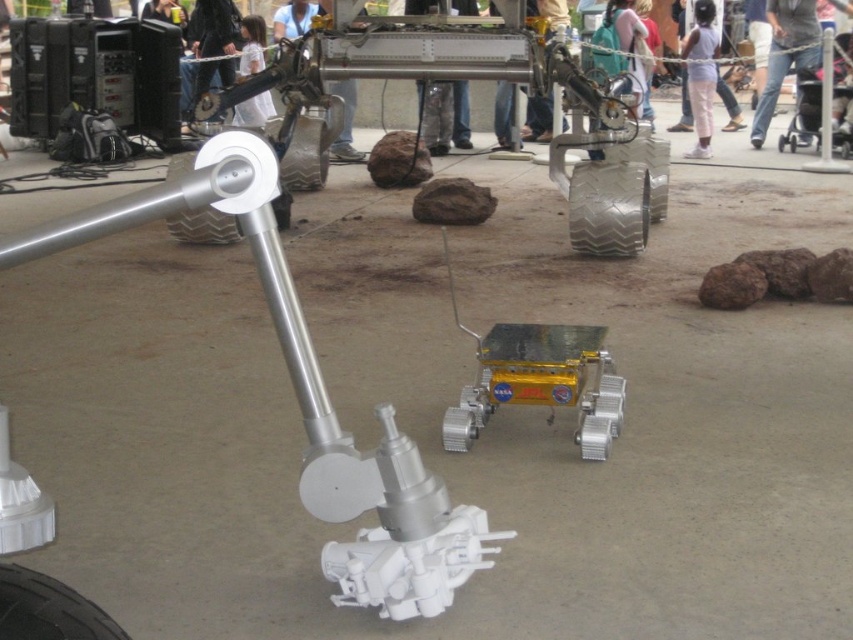
Can you confirm if black rubber tire at lower left is smaller than white fabric shirt at upper center?

Yes.

Who is shorter, black rubber tire at lower left or white fabric shirt at upper center?

black rubber tire at lower left

Locate an element on the screen. Image resolution: width=853 pixels, height=640 pixels. black rubber tire at lower left is located at coordinates (48, 609).

This screenshot has height=640, width=853. What are the coordinates of `black rubber tire at lower left` in the screenshot? It's located at (48, 609).

Is white cotton pants at upper right in front of white rubber tire at center?

That is False.

Is white cotton pants at upper right thinner than white rubber tire at center?

No, white cotton pants at upper right is not thinner than white rubber tire at center.

Identify the location of white cotton pants at upper right. The image size is (853, 640). (701, 74).

This screenshot has height=640, width=853. What are the coordinates of `white cotton pants at upper right` in the screenshot? It's located at (701, 74).

Is point (758, 115) closer to viewer compared to point (202, 1)?

Yes.

You are a GUI agent. You are given a task and a screenshot of the screen. Output one action in this format:
    pyautogui.click(x=<x>, y=<y>)
    Task: Click on the jeans at center
    
    Given the screenshot: What is the action you would take?
    pyautogui.click(x=785, y=54)

Where is `jeans at center`? This screenshot has height=640, width=853. jeans at center is located at coordinates (785, 54).